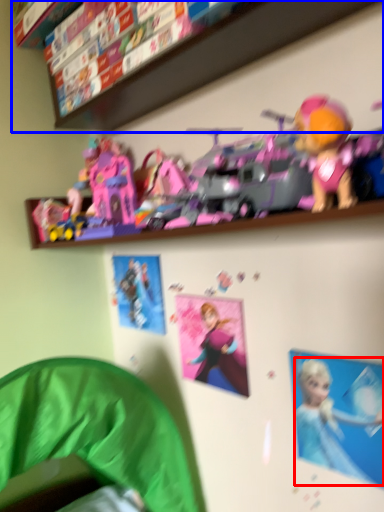
Question: Which object is further to the camera taking this photo, person (highlighted by a red box) or shelf (highlighted by a blue box)?

Choices:
 (A) person
 (B) shelf

Answer: (A)